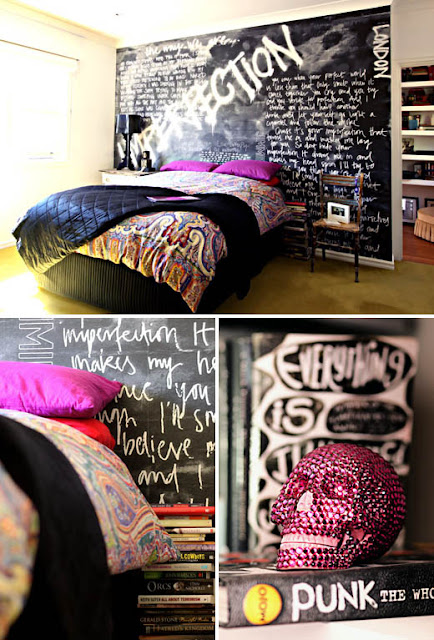
I want to click on black and white painted wall, so click(x=363, y=54).